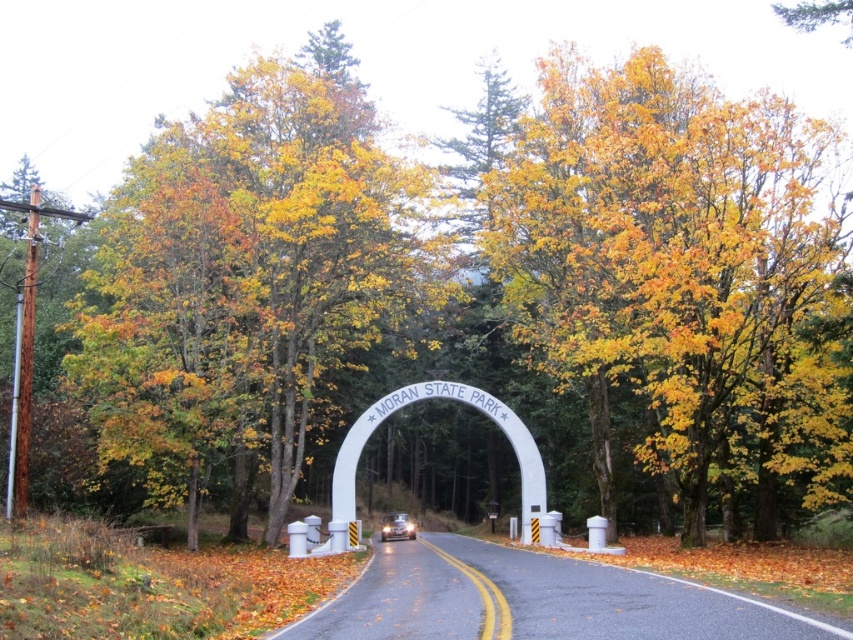
Question: Which of the following is the farthest from the observer?

Choices:
 (A) yellow-green foliage at center
 (B) white concrete archway at center

Answer: (B)

Question: Can you confirm if yellow leafy tree at center is wider than metallic silver car at center?

Choices:
 (A) no
 (B) yes

Answer: (B)

Question: Is white concrete archway at center below metallic silver car at center?

Choices:
 (A) yes
 (B) no

Answer: (B)

Question: Which is farther from the white concrete archway at center?

Choices:
 (A) yellow-green foliage at center
 (B) yellow leafy tree at center
 (C) metallic silver car at center

Answer: (B)

Question: Is yellow leafy tree at center wider than metallic silver car at center?

Choices:
 (A) no
 (B) yes

Answer: (B)

Question: Which object is the closest to the yellow leafy tree at center?

Choices:
 (A) metallic silver car at center
 (B) white concrete archway at center
 (C) yellow-green foliage at center

Answer: (B)